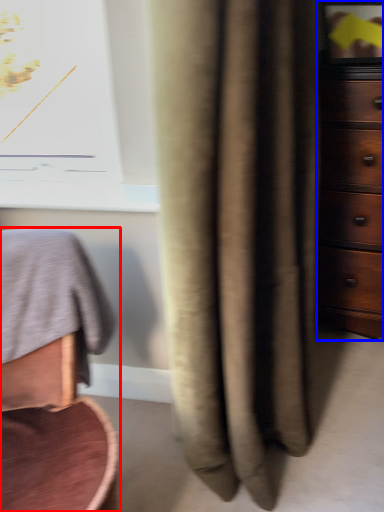
Question: Which point is further to the camera, furniture (highlighted by a red box) or chest of drawers (highlighted by a blue box)?

Choices:
 (A) furniture
 (B) chest of drawers

Answer: (B)